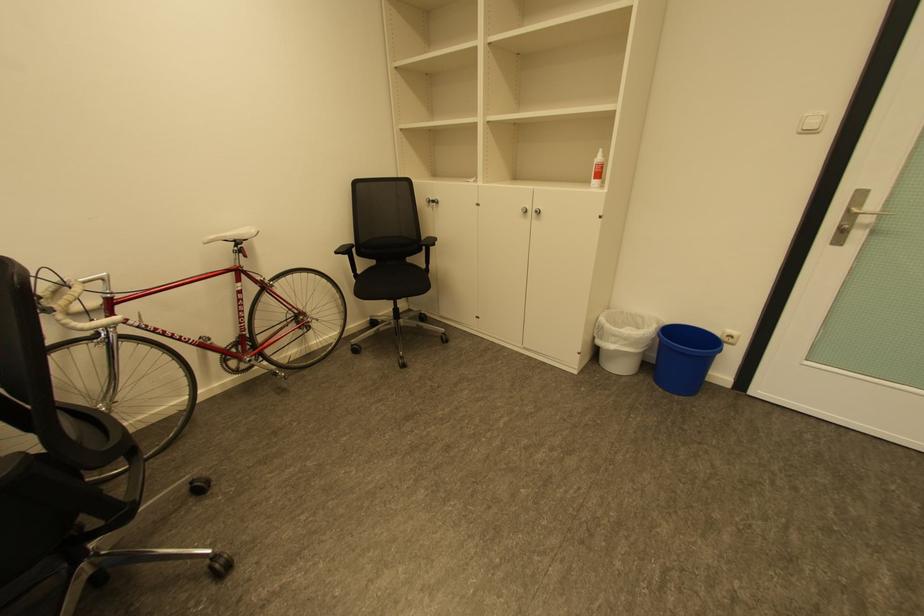
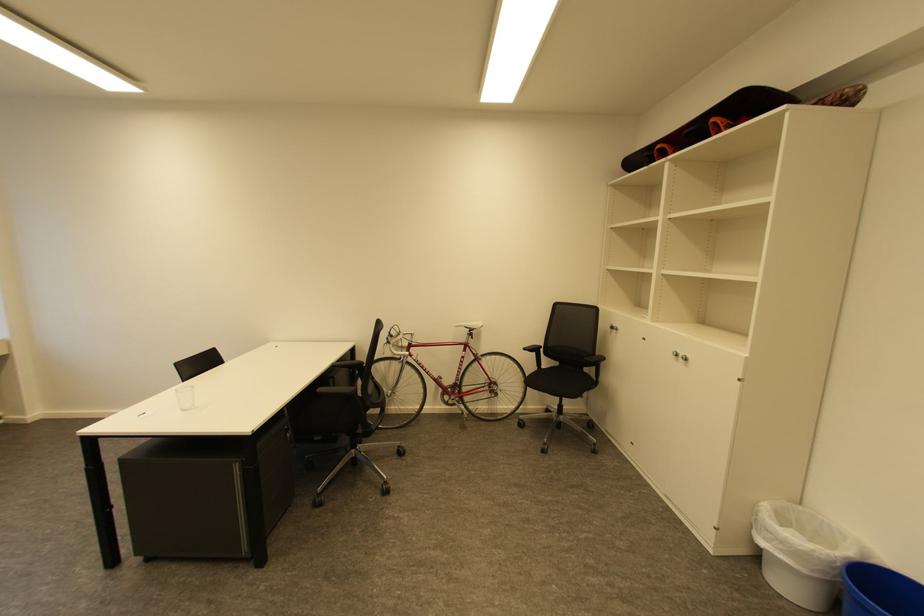
The point at (246, 281) is marked in the first image. Where is the corresponding point in the second image?

(471, 351)